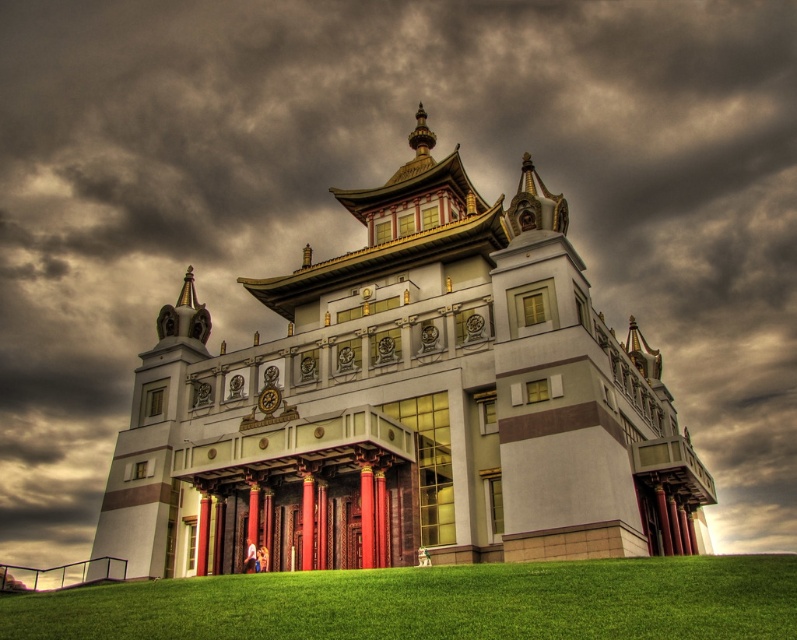
Question: Which point appears closest to the camera in this image?

Choices:
 (A) (462, 604)
 (B) (203, 557)

Answer: (A)

Question: Which point appears closest to the camera in this image?

Choices:
 (A) (521, 632)
 (B) (381, 467)

Answer: (A)

Question: Does white glossy palace at center appear over green grass at lower center?

Choices:
 (A) no
 (B) yes

Answer: (B)

Question: Can you confirm if white glossy palace at center is positioned to the left of green grass at lower center?

Choices:
 (A) no
 (B) yes

Answer: (A)

Question: Where is white glossy palace at center located in relation to green grass at lower center in the image?

Choices:
 (A) left
 (B) right

Answer: (B)